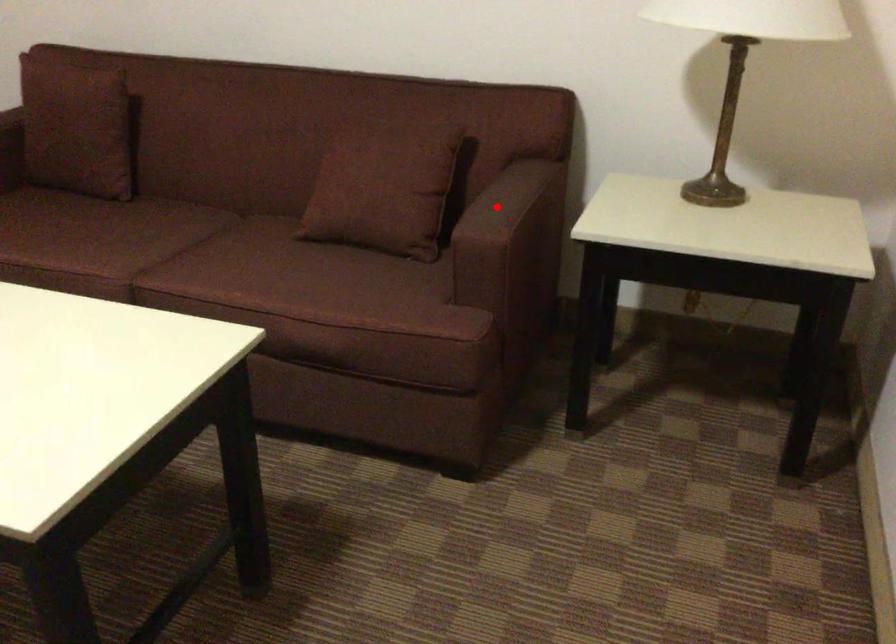
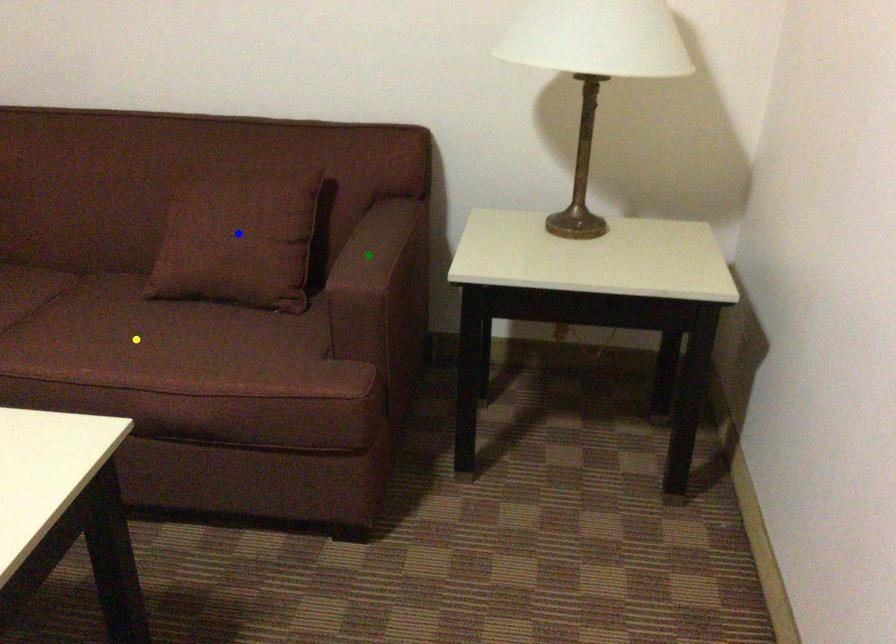
Question: I am providing you with two images of the same scene from different viewpoints. A red point is marked on the first image. You are given multiple points on the second image. In image 2, which mark is for the same physical point as the one in image 1?

Choices:
 (A) blue point
 (B) yellow point
 (C) green point

Answer: (C)